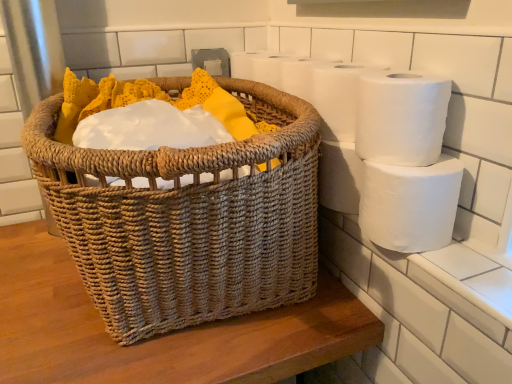
Question: Is point coord(387,180) positioned closer to the camera than point coord(345,129)?

Choices:
 (A) closer
 (B) farther

Answer: (A)

Question: Considering the positions of white matte toilet paper at right, which is counted as the 1th toilet paper, starting from the bottom, and white matte toilet paper at upper right, the first toilet paper in the top-to-bottom sequence, in the image, is white matte toilet paper at right, which is counted as the 1th toilet paper, starting from the bottom, bigger or smaller than white matte toilet paper at upper right, the first toilet paper in the top-to-bottom sequence,?

Choices:
 (A) small
 (B) big

Answer: (B)

Question: Estimate the real-world distances between objects in this image. Which object is farther from the white matte toilet paper at right, which is counted as the 1th toilet paper, starting from the bottom?

Choices:
 (A) woven natural basket at center
 (B) white matte toilet paper at upper right, the first toilet paper in the top-to-bottom sequence
 (C) white matte toilet paper at upper right, the 2th toilet paper positioned from the top

Answer: (A)

Question: Which object is the farthest from the white matte toilet paper at upper right, the first toilet paper in the top-to-bottom sequence?

Choices:
 (A) woven natural basket at center
 (B) white matte toilet paper at right, which is the 3th toilet paper from top to bottom
 (C) white matte toilet paper at upper right, the 2th toilet paper positioned from the top

Answer: (A)